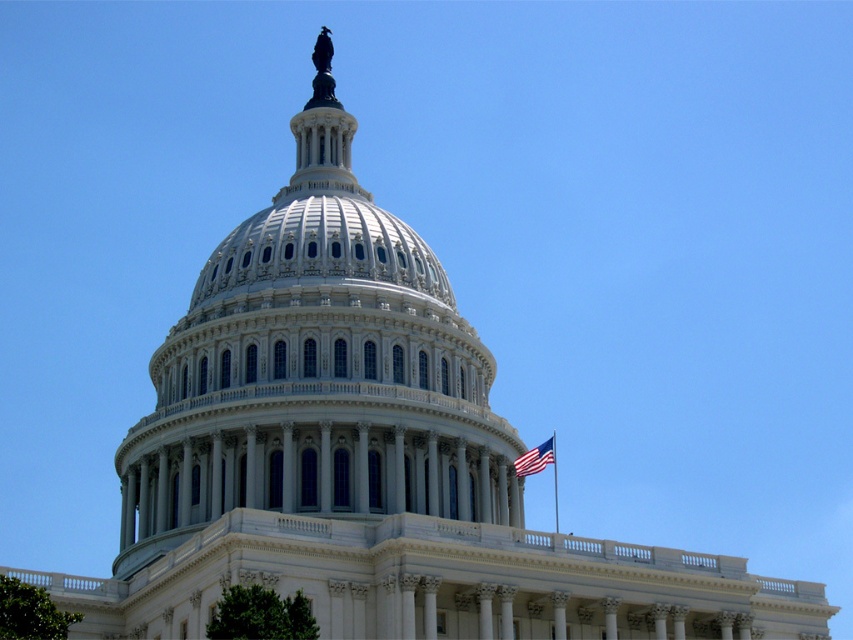
Does american flag at right have a lesser height compared to white flagpole at upper center?

Correct, american flag at right is not as tall as white flagpole at upper center.

What are the coordinates of `american flag at right` in the screenshot? It's located at (535, 458).

Which is above, white marble dome at center or white flagpole at upper center?

white marble dome at center is above.

Does white marble dome at center appear on the right side of white flagpole at upper center?

No, white marble dome at center is not to the right of white flagpole at upper center.

The height and width of the screenshot is (640, 853). Describe the element at coordinates (316, 371) in the screenshot. I see `white marble dome at center` at that location.

Identify the location of white marble dome at center. This screenshot has width=853, height=640. (316, 371).

Between white marble dome at center and american flag at right, which one appears on the right side from the viewer's perspective?

american flag at right

In order to click on white marble dome at center in this screenshot , I will do `click(316, 371)`.

I want to click on white marble dome at center, so tap(316, 371).